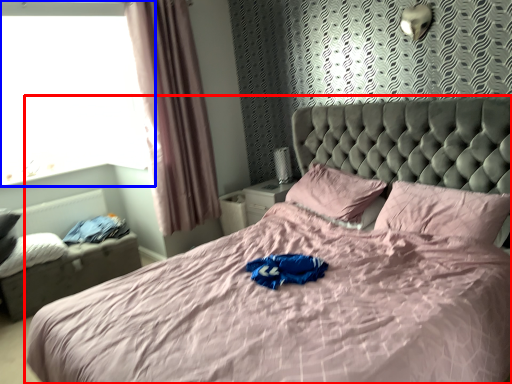
Question: Which point is closer to the camera, bed (highlighted by a red box) or window (highlighted by a blue box)?

Choices:
 (A) bed
 (B) window

Answer: (A)